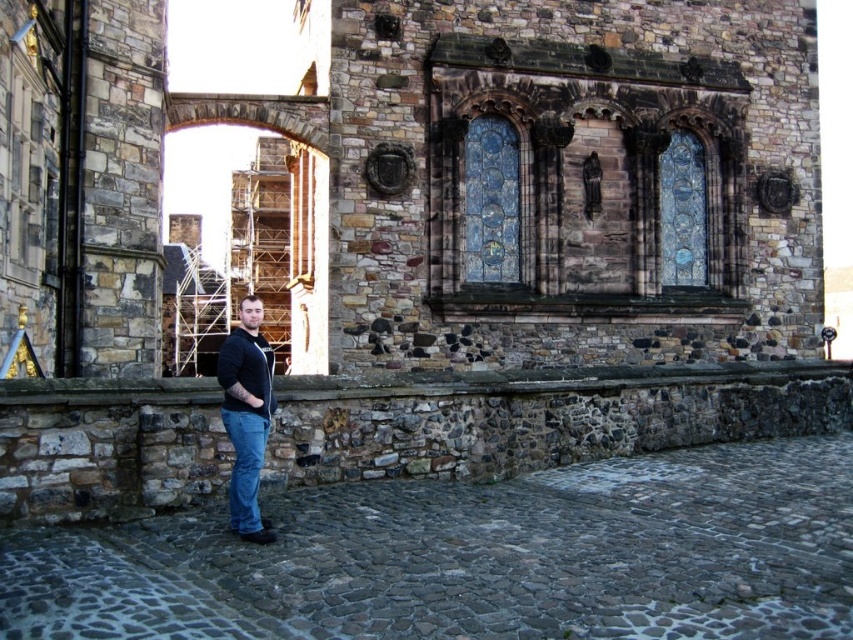
Can you confirm if brown stone ledge at center is smaller than denim at lower center?

No, brown stone ledge at center is not smaller than denim at lower center.

Is point (570, 372) less distant than point (252, 419)?

No, (570, 372) is behind (252, 419).

Is point (512, 392) farther from camera compared to point (241, 524)?

Yes, it is behind point (241, 524).

This screenshot has width=853, height=640. In order to click on brown stone ledge at center in this screenshot , I will do (550, 380).

Between denim at lower center and black matte shirt at lower center, which one is positioned higher?

Positioned higher is black matte shirt at lower center.

Does denim at lower center have a lesser height compared to black matte shirt at lower center?

Incorrect, denim at lower center's height does not fall short of black matte shirt at lower center's.

This screenshot has height=640, width=853. Find the location of `denim at lower center`. denim at lower center is located at coordinates (245, 467).

Where is `denim at lower center`? denim at lower center is located at coordinates (245, 467).

Does brown stone wall at lower left have a larger size compared to brown stone ledge at center?

Indeed, brown stone wall at lower left has a larger size compared to brown stone ledge at center.

Does brown stone wall at lower left have a greater width compared to brown stone ledge at center?

No, brown stone wall at lower left is not wider than brown stone ledge at center.

Is point (579, 397) farther from viewer compared to point (566, 376)?

No, (579, 397) is in front of (566, 376).

Locate an element on the screen. Image resolution: width=853 pixels, height=640 pixels. brown stone wall at lower left is located at coordinates (537, 417).